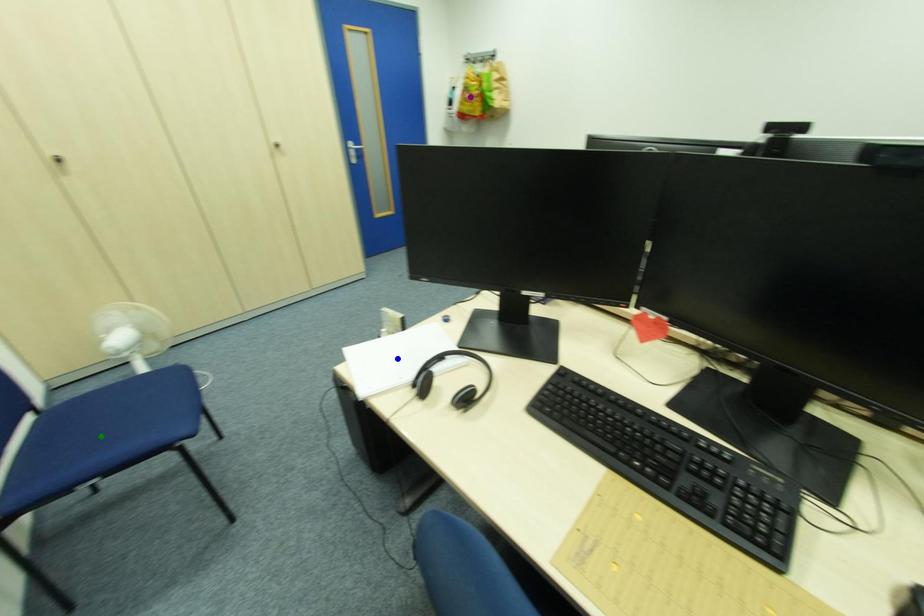
Based on the photo, order these from nearest to farthest:
blue point
purple point
green point

green point < blue point < purple point